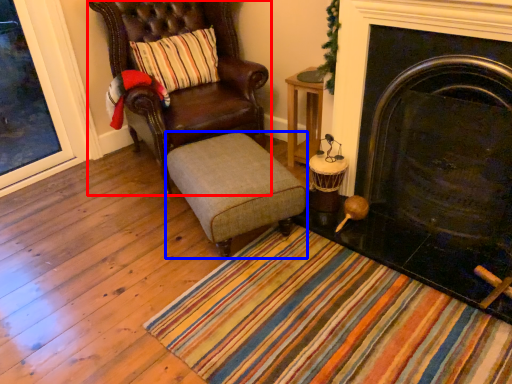
Question: Which point is further to the camera, chair (highlighted by a red box) or stool (highlighted by a blue box)?

Choices:
 (A) chair
 (B) stool

Answer: (A)